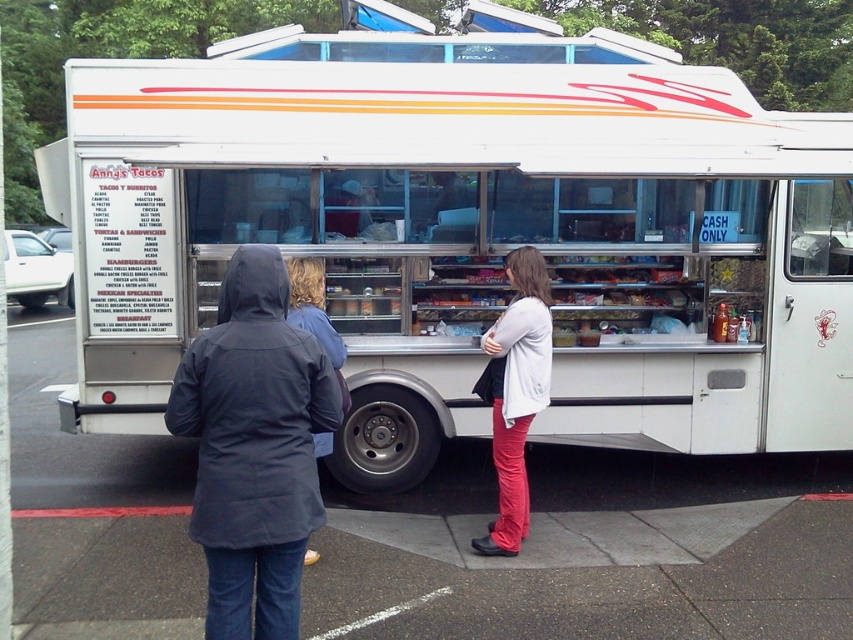
You are standing at the food truck and want to reach a point that is exactly 3 meters away from you. Is the point at coordinates point (227, 589) within your target distance?

The distance of point (227, 589) from viewer is 3.14 meters, so the point is slightly beyond your target distance of 3 meters.